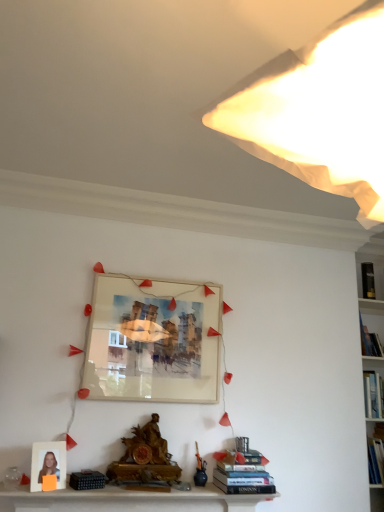
Question: From the image's perspective, is hardcover books at lower center, positioned as the 1th book in front-to-back order, located above or below white paper lampshade at upper right?

Choices:
 (A) above
 (B) below

Answer: (B)

Question: Considering the positions of hardcover books at lower center, positioned as the 1th book in front-to-back order, and white paper lampshade at upper right in the image, is hardcover books at lower center, positioned as the 1th book in front-to-back order, taller or shorter than white paper lampshade at upper right?

Choices:
 (A) tall
 (B) short

Answer: (B)

Question: Considering the real-world distances, which object is closest to the matte glass picture frame at center, which is the second picture frame from bottom to top?

Choices:
 (A) white matte photo frame at lower left, marked as the 2th picture frame in a back-to-front arrangement
 (B) white paper lampshade at upper right
 (C) blue hardcover book at upper right, which appears as the second book when viewed from the front
 (D) black hardcover book at upper right, positioned as the first book in back-to-front order
 (E) hardcover books at lower center, the 3th book when ordered from top to bottom

Answer: (E)

Question: Considering the real-world distances, which object is farthest from the black hardcover book at upper right, acting as the 3th book starting from the bottom?

Choices:
 (A) hardcover books at lower center, the first book from the left
 (B) matte glass picture frame at center, which appears as the 2th picture frame when viewed from the front
 (C) white paper lampshade at upper right
 (D) white matte photo frame at lower left, marked as the 2th picture frame in a back-to-front arrangement
 (E) blue hardcover book at upper right, which appears as the second book when viewed from the front

Answer: (C)